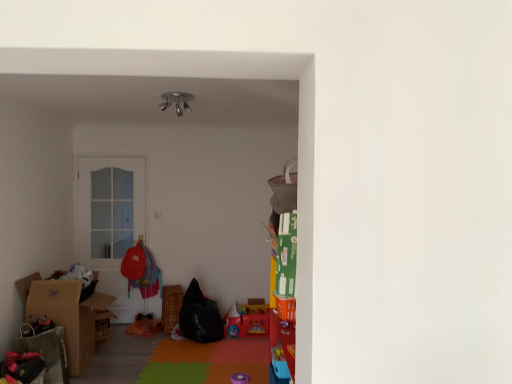
The width and height of the screenshot is (512, 384). What do you see at coordinates (141, 269) in the screenshot? I see `matte red backpack at center` at bounding box center [141, 269].

Identify the location of brown cardboard box at left. The image size is (512, 384). (69, 315).

Describe the element at coordinates (108, 209) in the screenshot. The image size is (512, 384). I see `white glass door at center` at that location.

The image size is (512, 384). I want to click on matte red backpack at center, so click(141, 269).

From a real-world perspective, between metallic chrome lamp at upper center and matte plastic toy at center, who is vertically lower?

matte plastic toy at center is physically lower.

Is metallic chrome lamp at upper center wider than matte plastic toy at center?

Result: In fact, metallic chrome lamp at upper center might be narrower than matte plastic toy at center.

Where is `lamp lying above the matte plastic toy at center (from the image's perspective)`? The height and width of the screenshot is (384, 512). lamp lying above the matte plastic toy at center (from the image's perspective) is located at coordinates (176, 101).

Does metallic chrome lamp at upper center turn towards matte plastic toy at center?

No, metallic chrome lamp at upper center is not facing towards matte plastic toy at center.

Could you tell me if gray fabric bean bag chair at upper right, positioned as the 1th bean bag chair in top-to-bottom order, is facing matte red backpack at center?

No, gray fabric bean bag chair at upper right, positioned as the 1th bean bag chair in top-to-bottom order, is not aimed at matte red backpack at center.

From the image's perspective, is gray fabric bean bag chair at upper right, arranged as the 1th bean bag chair when viewed from the right, over matte red backpack at center?

Yes, from the image's perspective, gray fabric bean bag chair at upper right, arranged as the 1th bean bag chair when viewed from the right, is on top of matte red backpack at center.

Considering the sizes of objects gray fabric bean bag chair at upper right, marked as the 2th bean bag chair in a back-to-front arrangement, and matte red backpack at center in the image provided, who is bigger, gray fabric bean bag chair at upper right, marked as the 2th bean bag chair in a back-to-front arrangement, or matte red backpack at center?

matte red backpack at center.

Is the depth of gray fabric bean bag chair at upper right, positioned as the 1th bean bag chair in top-to-bottom order, less than that of matte red backpack at center?

Yes, it is in front of matte red backpack at center.

Can we say metallic chrome lamp at upper center lies outside white glass door at center?

metallic chrome lamp at upper center lies outside white glass door at center's area.

What's the angular difference between metallic chrome lamp at upper center and white glass door at center's facing directions?

The angular difference between metallic chrome lamp at upper center and white glass door at center is 0.00227 degrees.

Is metallic chrome lamp at upper center thinner than white glass door at center?

No.

Which is nearer, (181,113) or (85,227)?

Point (181,113) appears to be closer to the viewer than point (85,227).

Is metallic chrome lamp at upper center wider than brown cardboard box at left?

In fact, metallic chrome lamp at upper center might be narrower than brown cardboard box at left.

Is point (176, 92) closer or farther from the camera than point (37, 315)?

Point (176, 92) is closer to the camera than point (37, 315).

In the scene shown: From a real-world perspective, is metallic chrome lamp at upper center above or below brown cardboard box at left?

metallic chrome lamp at upper center is situated higher than brown cardboard box at left in the real world.

Which of these two, metallic chrome lamp at upper center or brown cardboard box at left, stands taller?

Standing taller between the two is brown cardboard box at left.

From a real-world perspective, between gray fabric bean bag chair at upper right, arranged as the 1th bean bag chair when viewed from the right, and black fabric bean bag at center, the 1th bean bag chair positioned from the back, who is vertically lower?

black fabric bean bag at center, the 1th bean bag chair positioned from the back.

From the image's perspective, between gray fabric bean bag chair at upper right, the first bean bag chair positioned from the front, and black fabric bean bag at center, the 1th bean bag chair positioned from the back, who is located below?

black fabric bean bag at center, the 1th bean bag chair positioned from the back, appears lower in the image.

In the image, is gray fabric bean bag chair at upper right, the first bean bag chair positioned from the front, positioned in front of or behind black fabric bean bag at center, arranged as the 1th bean bag chair when viewed from the left?

gray fabric bean bag chair at upper right, the first bean bag chair positioned from the front, is in front of black fabric bean bag at center, arranged as the 1th bean bag chair when viewed from the left.

Does gray fabric bean bag chair at upper right, arranged as the 1th bean bag chair when viewed from the right, have a lesser width compared to black fabric bean bag at center, which appears as the second bean bag chair when viewed from the front?

Indeed, gray fabric bean bag chair at upper right, arranged as the 1th bean bag chair when viewed from the right, has a lesser width compared to black fabric bean bag at center, which appears as the second bean bag chair when viewed from the front.

From the image's perspective, is matte plastic toy at center on top of woven brown picnic basket at center?

No, from the image's perspective, matte plastic toy at center is not over woven brown picnic basket at center.

Would you say matte plastic toy at center is a long distance from woven brown picnic basket at center?

Actually, matte plastic toy at center and woven brown picnic basket at center are a little close together.

Is matte plastic toy at center looking in the opposite direction of woven brown picnic basket at center?

No, woven brown picnic basket at center is not at the back of matte plastic toy at center.

What's the angular difference between matte plastic toy at center and woven brown picnic basket at center's facing directions?

They differ by 17.1 degrees in their facing directions.

Is brown cardboard box at left facing towards gray fabric bean bag chair at upper right, arranged as the 1th bean bag chair when viewed from the right?

No, brown cardboard box at left is not aimed at gray fabric bean bag chair at upper right, arranged as the 1th bean bag chair when viewed from the right.

Considering the relative sizes of brown cardboard box at left and gray fabric bean bag chair at upper right, positioned as the 1th bean bag chair in top-to-bottom order, in the image provided, is brown cardboard box at left taller than gray fabric bean bag chair at upper right, positioned as the 1th bean bag chair in top-to-bottom order,?

Yes.

Is brown cardboard box at left not inside gray fabric bean bag chair at upper right, arranged as the 1th bean bag chair when viewed from the right?

Yes.

What's the angular difference between brown cardboard box at left and gray fabric bean bag chair at upper right, positioned as the 1th bean bag chair in top-to-bottom order,'s facing directions?

177 degrees separate the facing orientations of brown cardboard box at left and gray fabric bean bag chair at upper right, positioned as the 1th bean bag chair in top-to-bottom order.

Image resolution: width=512 pixels, height=384 pixels. I want to click on lamp to the left of matte plastic toy at center, so click(x=176, y=101).

This screenshot has width=512, height=384. Find the location of `laundry behind the gray fabric bean bag chair at upper right, marked as the 2th bean bag chair in a back-to-front arrangement`. laundry behind the gray fabric bean bag chair at upper right, marked as the 2th bean bag chair in a back-to-front arrangement is located at coordinates 141,269.

Estimate the real-world distances between objects in this image. Which object is further from gray fabric bean bag chair at upper right, positioned as the 2th bean bag chair in bottom-to-top order, matte plastic toy at center or black fabric bean bag at center, which appears as the second bean bag chair when viewed from the top?

The object further to gray fabric bean bag chair at upper right, positioned as the 2th bean bag chair in bottom-to-top order, is matte plastic toy at center.

Looking at the image, which one is located closer to woven brown picnic basket at center, metallic chrome lamp at upper center or white glass door at center?

white glass door at center is positioned closer to the anchor woven brown picnic basket at center.

Based on their spatial positions, is brown cardboard box at left or matte plastic toy at center further from metallic chrome lamp at upper center?

matte plastic toy at center lies further to metallic chrome lamp at upper center than the other object.

When comparing their distances from metallic chrome lamp at upper center, does matte plastic toy at center or white glass door at center seem further?

matte plastic toy at center lies further to metallic chrome lamp at upper center than the other object.

Estimate the real-world distances between objects in this image. Which object is further from gray fabric bean bag chair at upper right, positioned as the 1th bean bag chair in top-to-bottom order, matte red backpack at center or brown cardboard box at left?

matte red backpack at center is positioned further to the anchor gray fabric bean bag chair at upper right, positioned as the 1th bean bag chair in top-to-bottom order.

In the scene shown: Which object lies nearer to the anchor point brown cardboard box at left, matte red backpack at center or matte plastic toy at center?

The object closer to brown cardboard box at left is matte red backpack at center.

Considering their positions, is gray fabric bean bag chair at upper right, which is counted as the 2th bean bag chair, starting from the left, positioned closer to metallic chrome lamp at upper center than matte red backpack at center?

gray fabric bean bag chair at upper right, which is counted as the 2th bean bag chair, starting from the left, is positioned closer to the anchor metallic chrome lamp at upper center.

Looking at the image, which one is located closer to brown cardboard box at left, metallic chrome lamp at upper center or matte plastic toy at center?

Among the two, matte plastic toy at center is located nearer to brown cardboard box at left.

Where is `bean bag chair situated between matte red backpack at center and matte plastic toy at center from left to right`? bean bag chair situated between matte red backpack at center and matte plastic toy at center from left to right is located at coordinates (200, 316).

This screenshot has height=384, width=512. I want to click on picnic basket situated between matte red backpack at center and black fabric bean bag at center, which appears as the second bean bag chair when viewed from the front, from left to right, so click(x=170, y=306).

This screenshot has height=384, width=512. Find the location of `laundry between white glass door at center and black fabric bean bag at center, the first bean bag chair positioned from the bottom, in the horizontal direction`. laundry between white glass door at center and black fabric bean bag at center, the first bean bag chair positioned from the bottom, in the horizontal direction is located at coordinates (141, 269).

Where is `bean bag chair between gray fabric bean bag chair at upper right, positioned as the 1th bean bag chair in top-to-bottom order, and white glass door at center, along the z-axis`? bean bag chair between gray fabric bean bag chair at upper right, positioned as the 1th bean bag chair in top-to-bottom order, and white glass door at center, along the z-axis is located at coordinates (200, 316).